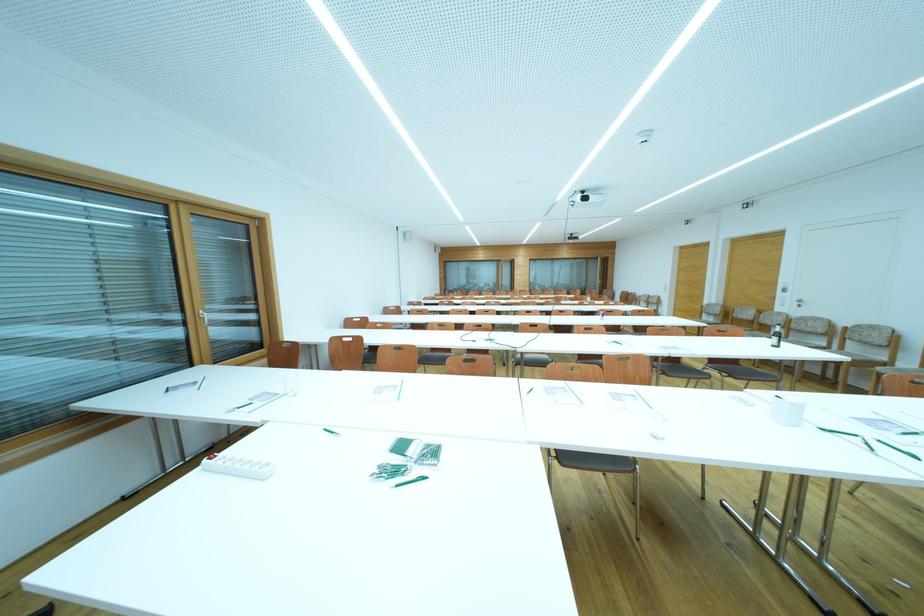
What do you see at coordinates (202, 315) in the screenshot? The image size is (924, 616). I see `a window handle` at bounding box center [202, 315].